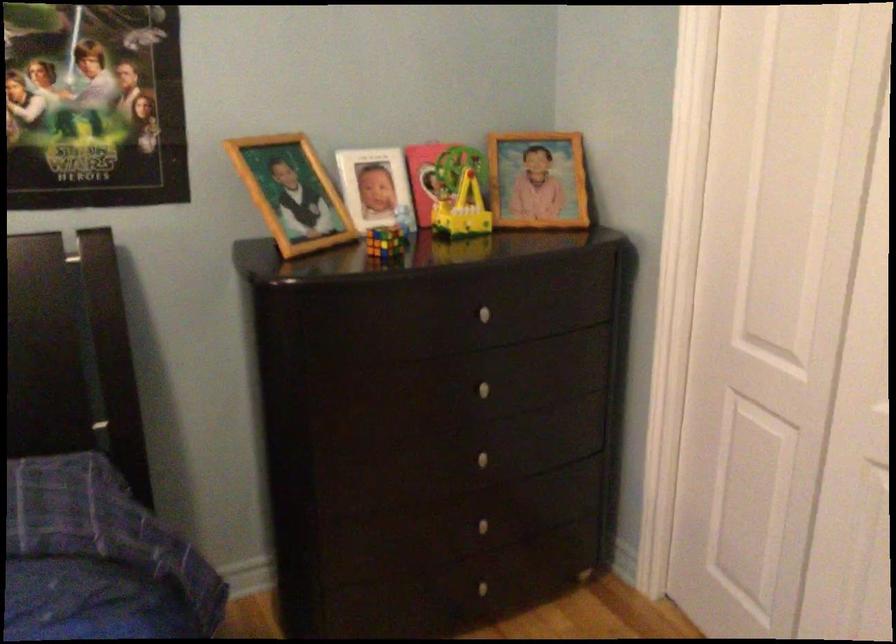
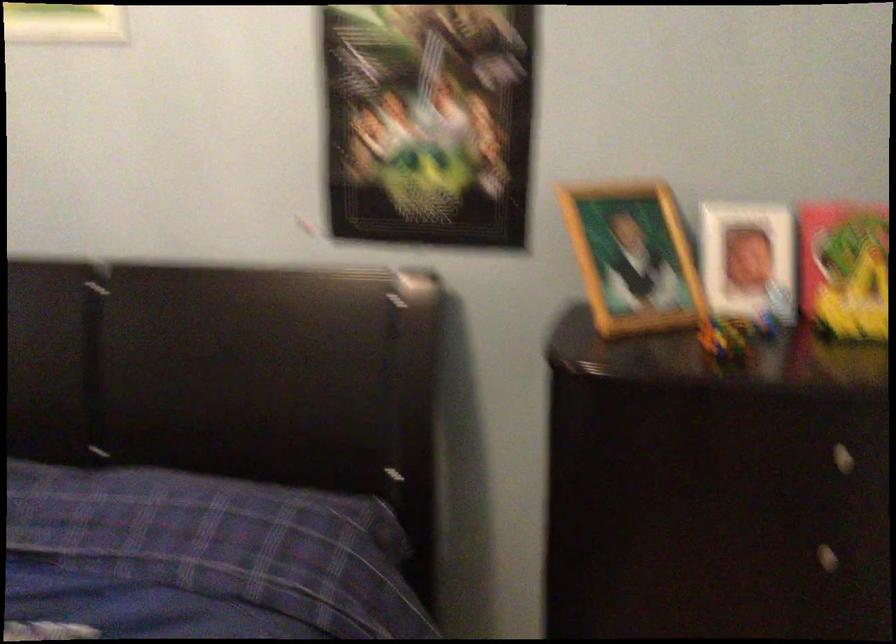
The point at (298, 194) is marked in the first image. Where is the corresponding point in the second image?

(633, 258)